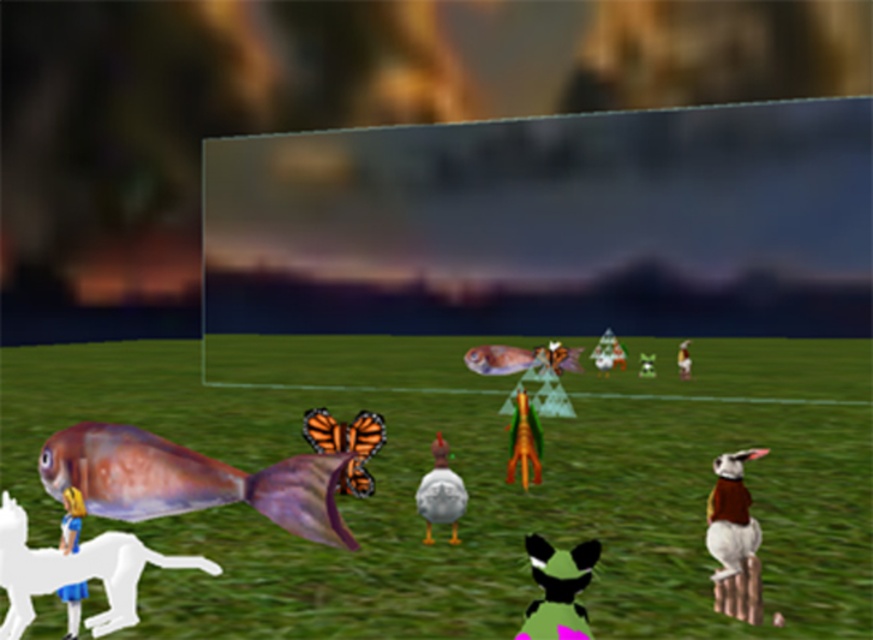
Question: Which object appears farthest from the camera in this image?

Choices:
 (A) green matte toy at center
 (B) white matte rabbit at center

Answer: (B)

Question: Is white matte duck at center in front of green matte toy at center?

Choices:
 (A) yes
 (B) no

Answer: (A)

Question: Is white matte rabbit at right further to camera compared to white matte duck at center?

Choices:
 (A) no
 (B) yes

Answer: (A)

Question: Considering the real-world distances, which object is farthest from the white matte duck at center?

Choices:
 (A) green grass field at center
 (B) orangetexturebutterfly at center
 (C) white matte rabbit at right
 (D) shiny metallic fish at lower left

Answer: (A)

Question: Can you confirm if green grass field at center is wider than white matte duck at center?

Choices:
 (A) yes
 (B) no

Answer: (A)

Question: Estimate the real-world distances between objects in this image. Which object is closer to the shiny plastic toy at center?

Choices:
 (A) orangetexturebutterfly at center
 (B) matte plastic toy at lower left

Answer: (A)